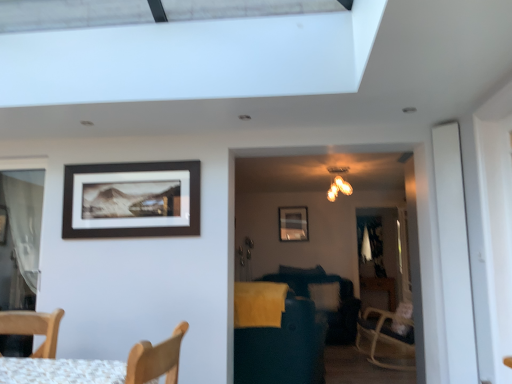
Where is `vacant region above matte black picture frame at upper center, which is the 2th picture frame from right to left (from a real-world perspective)`? Image resolution: width=512 pixels, height=384 pixels. vacant region above matte black picture frame at upper center, which is the 2th picture frame from right to left (from a real-world perspective) is located at coordinates (136, 158).